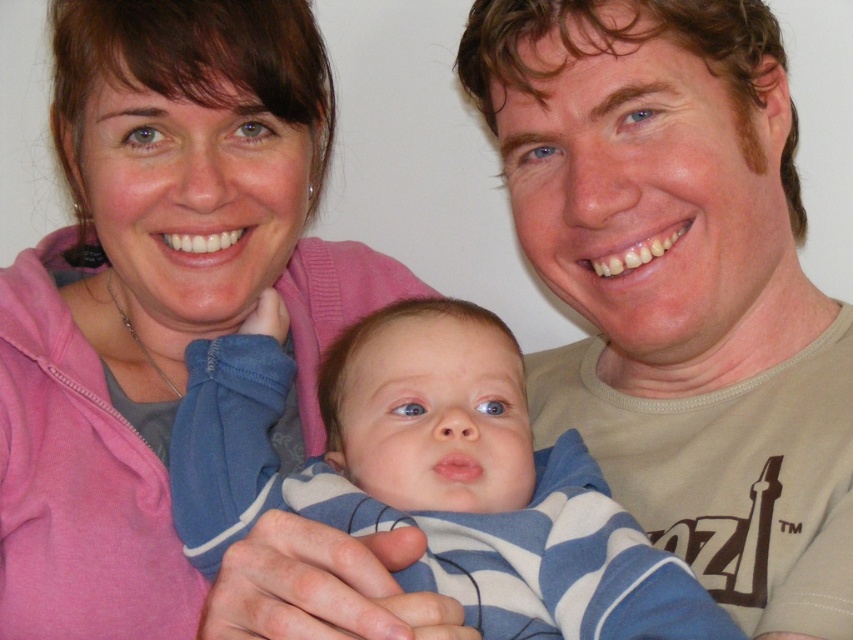
Question: Which object appears closest to the camera in this image?

Choices:
 (A) matte beige t-shirt at center
 (B) pink fleece at upper left
 (C) blue striped onesie at center

Answer: (C)

Question: Which point is closer to the camera?

Choices:
 (A) matte beige t-shirt at center
 (B) blue striped onesie at center

Answer: (B)

Question: Is pink fleece at upper left thinner than matte beige t-shirt at center?

Choices:
 (A) yes
 (B) no

Answer: (B)

Question: Which point is farther to the camera?

Choices:
 (A) (782, 406)
 (B) (418, 460)
 (C) (50, 378)

Answer: (C)

Question: Is matte beige t-shirt at center below blue striped onesie at center?

Choices:
 (A) yes
 (B) no

Answer: (B)

Question: Is pink fleece at upper left above matte beige t-shirt at center?

Choices:
 (A) yes
 (B) no

Answer: (B)